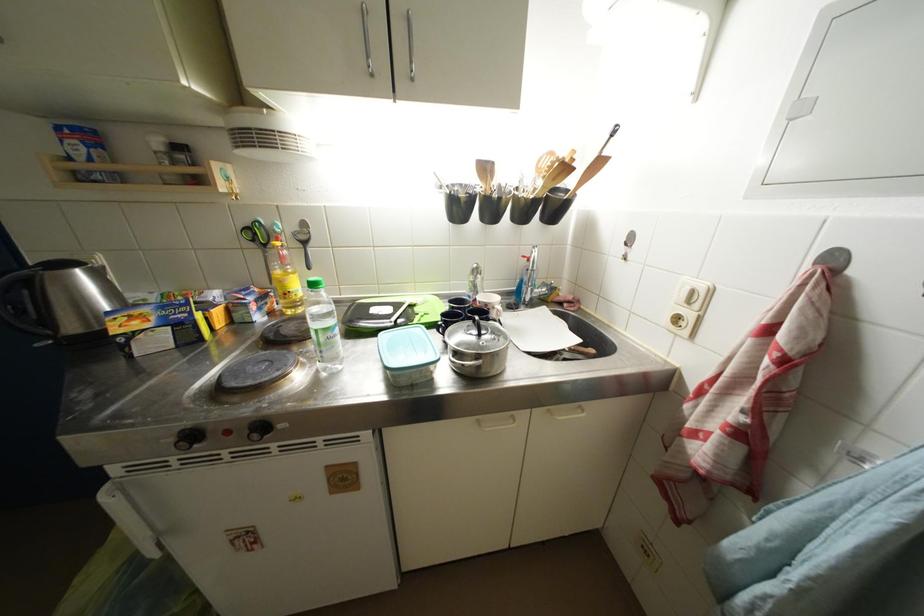
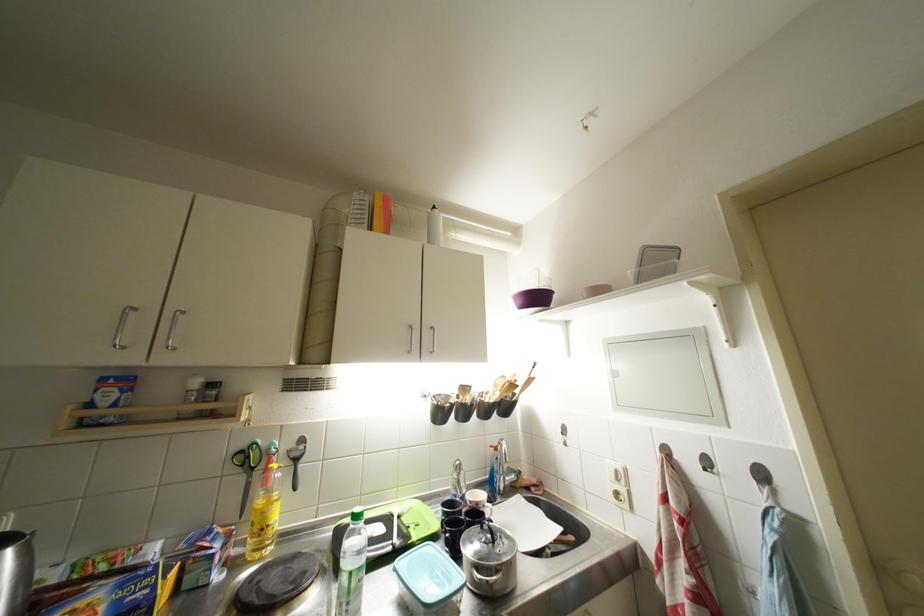
Find the pixel in the second image that matches (x=253, y=227) in the first image.

(249, 450)